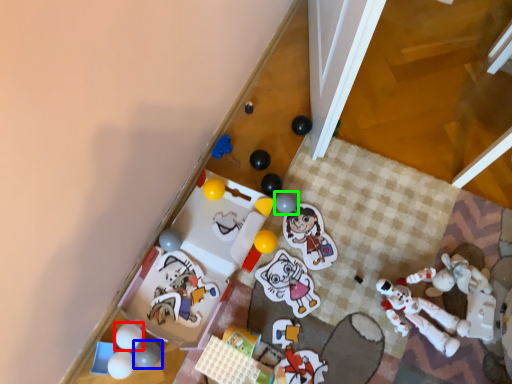
Question: Which is farther away from toy (highlighted by a red box)? toy (highlighted by a blue box) or toy (highlighted by a green box)?

Choices:
 (A) toy
 (B) toy

Answer: (B)